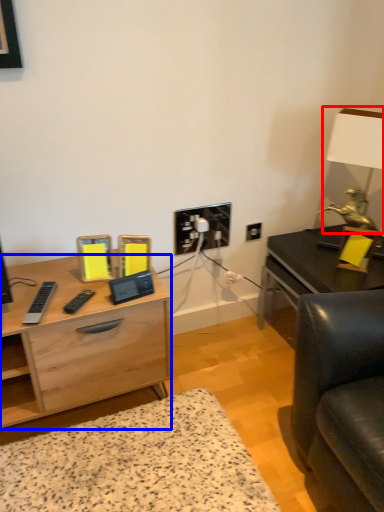
Question: Among these objects, which one is nearest to the camera, table lamp (highlighted by a red box) or desk (highlighted by a blue box)?

Choices:
 (A) table lamp
 (B) desk

Answer: (B)